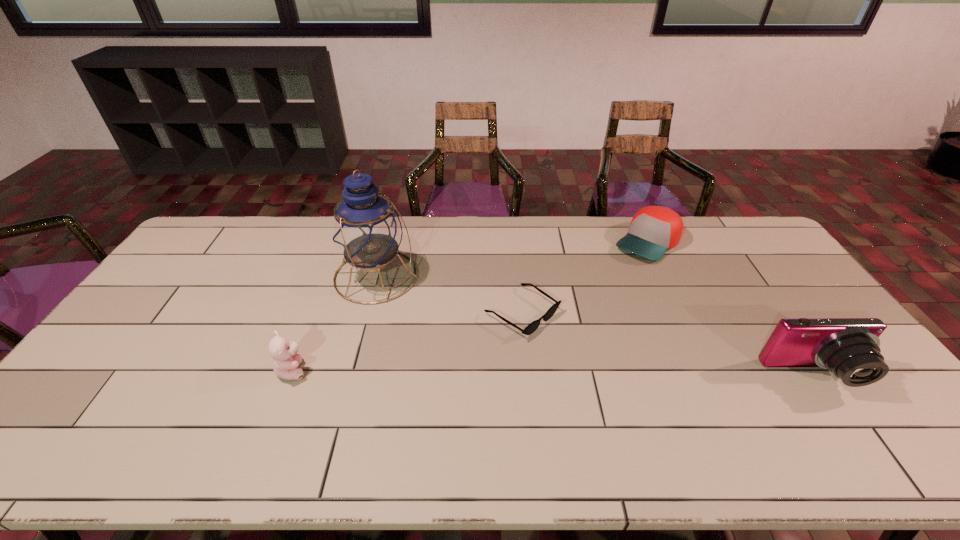
Where is `vacant space that is in between the sunglasses and the fourth shortest object`? The height and width of the screenshot is (540, 960). vacant space that is in between the sunglasses and the fourth shortest object is located at coordinates (668, 345).

Identify the location of free area in between the rightmost object and the baseball cap. The height and width of the screenshot is (540, 960). (731, 309).

You are a GUI agent. You are given a task and a screenshot of the screen. Output one action in this format:
    pyautogui.click(x=<x>, y=<y>)
    Task: Click on the vacant space in between the sunglasses and the tallest object
    
    Given the screenshot: What is the action you would take?
    pyautogui.click(x=449, y=294)

Identify the location of free space that is in between the camera and the sunglasses. (668, 345).

Image resolution: width=960 pixels, height=540 pixels. I want to click on free point between the second tallest object and the tallest object, so click(x=595, y=326).

In order to click on free space between the third object from right to left and the lantern in this screenshot , I will do `click(449, 294)`.

Identify the location of free space that is in between the shortest object and the camera. The image size is (960, 540). (668, 345).

This screenshot has width=960, height=540. In order to click on vacant point located between the rightmost object and the baseball cap in this screenshot , I will do tap(731, 309).

Find the location of `the second closest object to the camera`. the second closest object to the camera is located at coordinates (x=534, y=325).

Identify which object is the third nearest to the second tallest object. Please provide its 2D coordinates. Your answer should be formatted as a tuple, i.e. [(x, y)], where the tuple contains the x and y coordinates of a point satisfying the conditions above.

[(367, 230)]